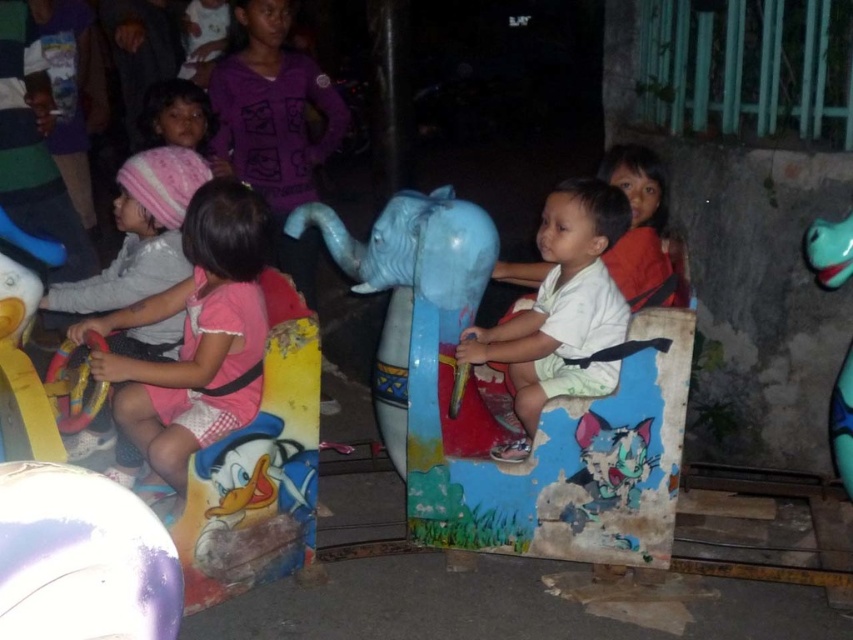
Who is lower down, pink fabric dress at left or white matte elephant at center?

pink fabric dress at left is lower down.

Which of these two, pink fabric dress at left or white matte elephant at center, stands taller?

pink fabric dress at left

Between point (254, 403) and point (492, 337), which one is positioned behind?

The point (492, 337) is more distant.

Identify the location of pink fabric dress at left. The image size is (853, 640). (196, 337).

Which is in front, point (538, 333) or point (524, 387)?

Point (538, 333) is more forward.

Which of these two, blue painted plastic elephant at center or white matte elephant at center, stands shorter?

white matte elephant at center is shorter.

Which is in front, point (596, 406) or point (488, 344)?

Point (596, 406) is in front.

Where is `blue painted plastic elephant at center`? The height and width of the screenshot is (640, 853). blue painted plastic elephant at center is located at coordinates (532, 378).

Consider the image. Does white matte elephant at center have a lesser width compared to teal rubber elephant at right?

In fact, white matte elephant at center might be wider than teal rubber elephant at right.

Locate an element on the screen. The height and width of the screenshot is (640, 853). white matte elephant at center is located at coordinates (561, 308).